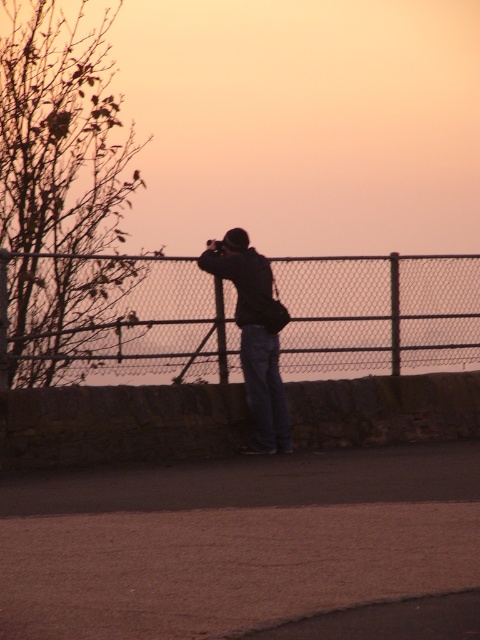
Is metallic chain-link fence at center above dark blue jeans at center?

Correct, metallic chain-link fence at center is located above dark blue jeans at center.

Which of these two, metallic chain-link fence at center or dark blue jeans at center, stands shorter?

metallic chain-link fence at center is shorter.

What do you see at coordinates (115, 317) in the screenshot?
I see `metallic chain-link fence at center` at bounding box center [115, 317].

Locate an element on the screen. The height and width of the screenshot is (640, 480). metallic chain-link fence at center is located at coordinates (115, 317).